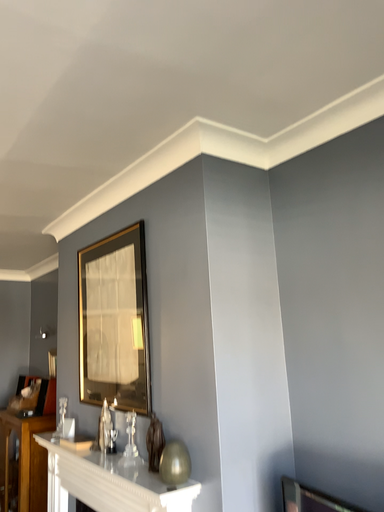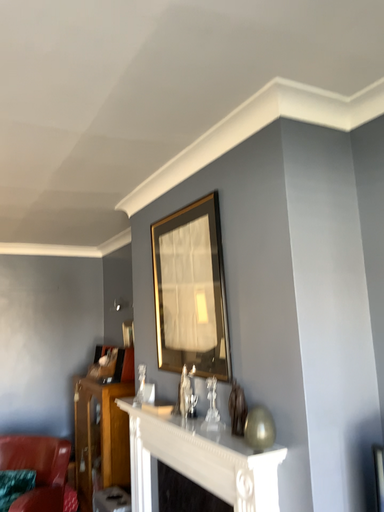
Question: How did the camera likely rotate when shooting the video?

Choices:
 (A) rotated left
 (B) rotated right

Answer: (A)